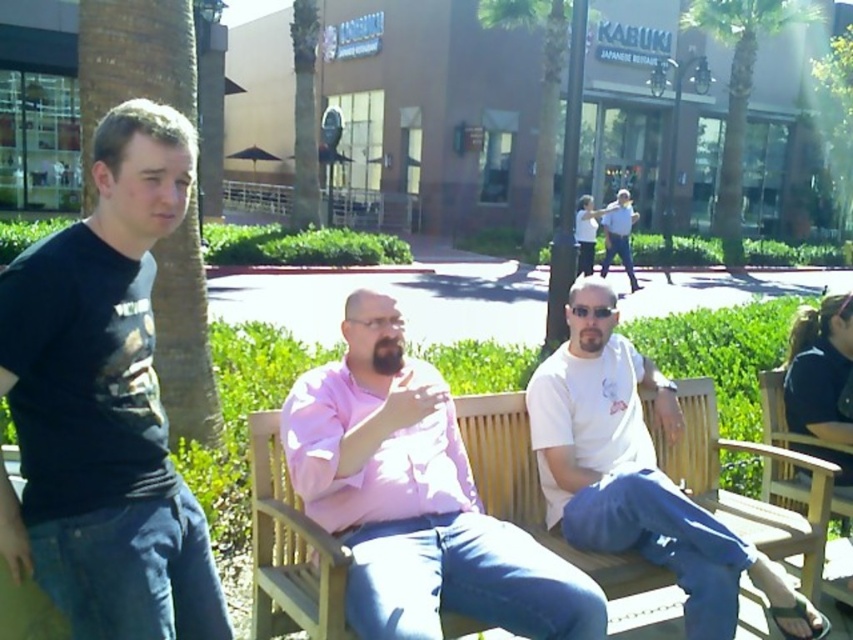
Question: Which point appears farthest from the camera in this image?

Choices:
 (A) (160, 461)
 (B) (360, 534)

Answer: (B)

Question: Does black cotton t-shirt at left have a larger size compared to wooden bench at center?

Choices:
 (A) no
 (B) yes

Answer: (A)

Question: Which object is positioned farthest from the wooden bench at center?

Choices:
 (A) pink matte shirt at center
 (B) white cotton shirt at center

Answer: (A)

Question: Can you confirm if black cotton t-shirt at left is smaller than wooden bench at center?

Choices:
 (A) no
 (B) yes

Answer: (B)

Question: Can you confirm if pink matte shirt at center is positioned to the left of white cotton shirt at center?

Choices:
 (A) yes
 (B) no

Answer: (A)

Question: Considering the real-world distances, which object is closest to the white cotton shirt at center?

Choices:
 (A) pink matte shirt at center
 (B) black cotton t-shirt at left

Answer: (A)